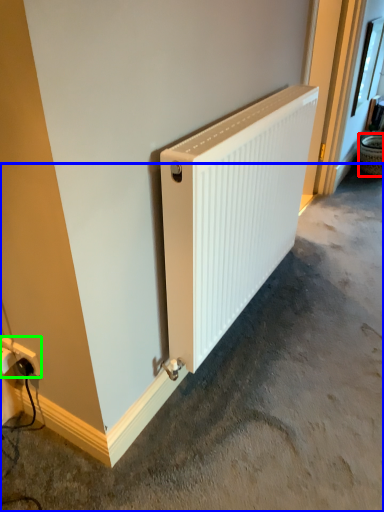
Question: Estimate the real-world distances between objects in this image. Which object is farther from basket (highlighted by a red box), concrete (highlighted by a blue box) or power plugs and sockets (highlighted by a green box)?

Choices:
 (A) concrete
 (B) power plugs and sockets

Answer: (B)